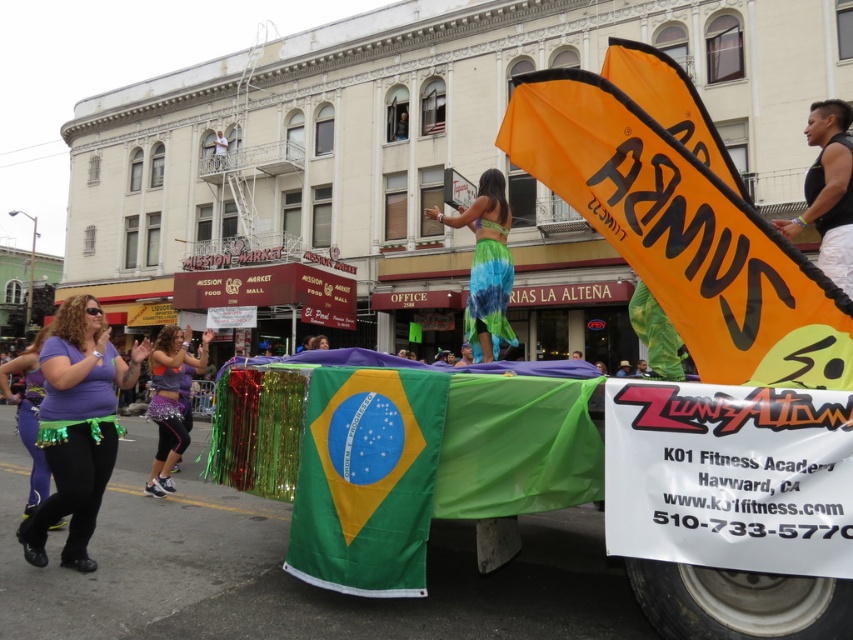
Which is more to the left, purple fabric skirt at lower left or black tank top at upper right?

From the viewer's perspective, purple fabric skirt at lower left appears more on the left side.

Is purple fabric skirt at lower left taller than black tank top at upper right?

Incorrect, purple fabric skirt at lower left's height is not larger of black tank top at upper right's.

Where is `purple fabric skirt at lower left`? purple fabric skirt at lower left is located at coordinates (77, 426).

Where is `purple fabric skirt at lower left`? Image resolution: width=853 pixels, height=640 pixels. purple fabric skirt at lower left is located at coordinates (77, 426).

Who is lower down, black tank top at upper right or purple shiny leggings at lower left?

purple shiny leggings at lower left

Can you confirm if black tank top at upper right is positioned above purple shiny leggings at lower left?

Correct, black tank top at upper right is located above purple shiny leggings at lower left.

Between point (830, 104) and point (33, 420), which one is positioned in front?

Point (830, 104) is in front.

Identify the location of black tank top at upper right. (828, 192).

From the picture: Is black tank top at upper right shorter than purple shiny leggings at center?

In fact, black tank top at upper right may be taller than purple shiny leggings at center.

Who is more distant from viewer, (834, 148) or (173, 444)?

The point (173, 444) is behind.

Is point (776, 228) closer to viewer compared to point (164, 340)?

Yes, it is in front of point (164, 340).

The width and height of the screenshot is (853, 640). I want to click on black tank top at upper right, so click(x=828, y=192).